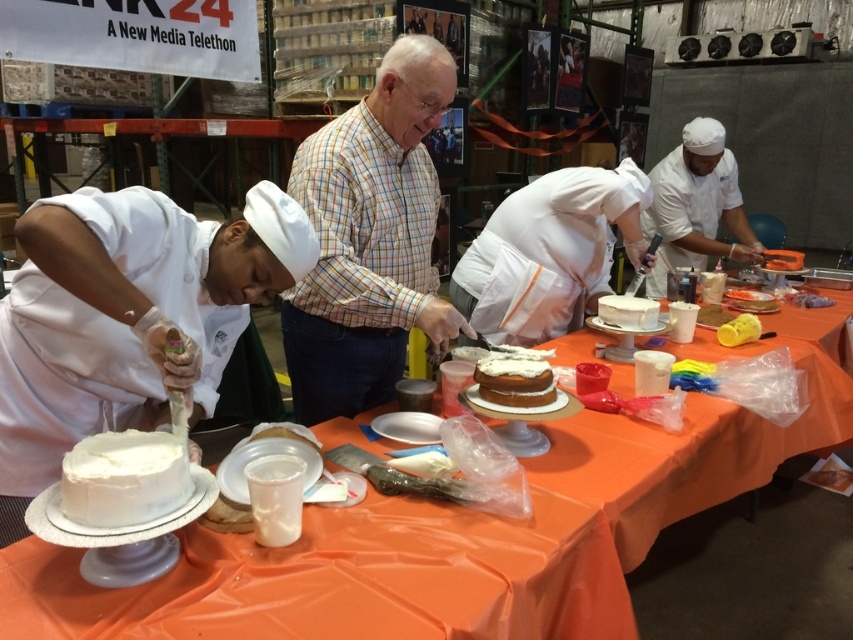
Question: Among these points, which one is farthest from the camera?

Choices:
 (A) (x=546, y=376)
 (B) (x=195, y=237)
 (C) (x=184, y=484)
 (D) (x=540, y=612)

Answer: (A)

Question: Is white matte chef hat at upper right above white frosted cake at center?

Choices:
 (A) no
 (B) yes

Answer: (B)

Question: Does white matte chef hat at left appear under plaid shirt at center?

Choices:
 (A) no
 (B) yes

Answer: (B)

Question: Can you confirm if white matte chef hat at upper right is positioned below white frosted cake at center?

Choices:
 (A) no
 (B) yes

Answer: (A)

Question: Which object is closer to the camera taking this photo?

Choices:
 (A) orange fabric table at center
 (B) white frosted cake at center
 (C) white matte chef hat at center

Answer: (A)

Question: Which of the following is the closest to the observer?

Choices:
 (A) white matte chef hat at left
 (B) orange fabric table at center

Answer: (A)